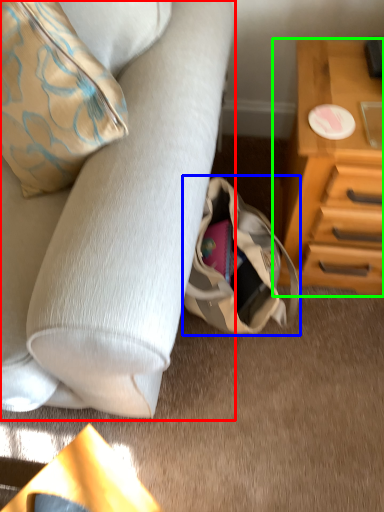
Question: Estimate the real-world distances between objects in this image. Which object is closer to studio couch (highlighted by a red box), handbag (highlighted by a blue box) or chest of drawers (highlighted by a green box)?

Choices:
 (A) handbag
 (B) chest of drawers

Answer: (A)